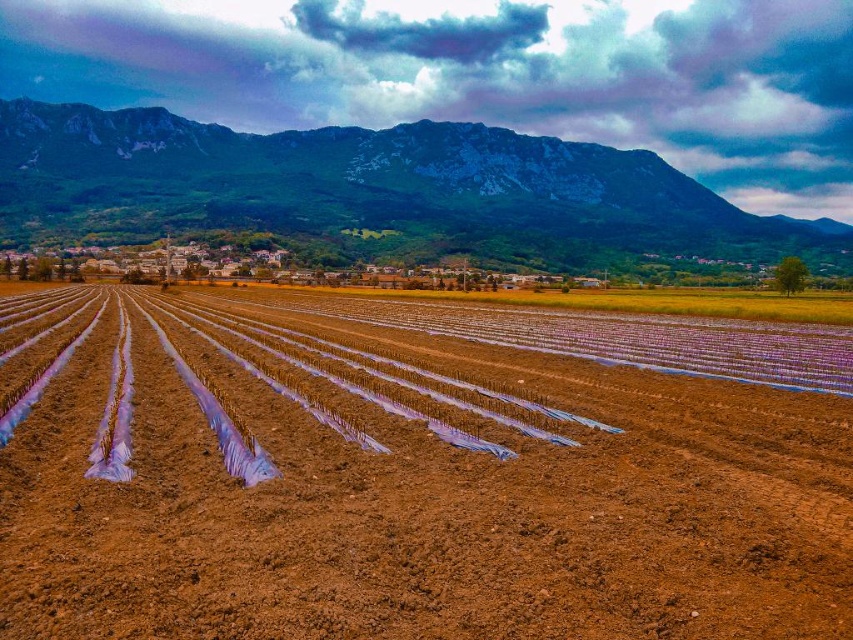
Is point (33, 540) positioned in front of point (653, 211)?

Yes, point (33, 540) is closer to viewer.

Which is in front, point (531, 628) or point (318, 182)?

Point (531, 628)

The image size is (853, 640). Find the location of `brown soil at center`. brown soil at center is located at coordinates (413, 476).